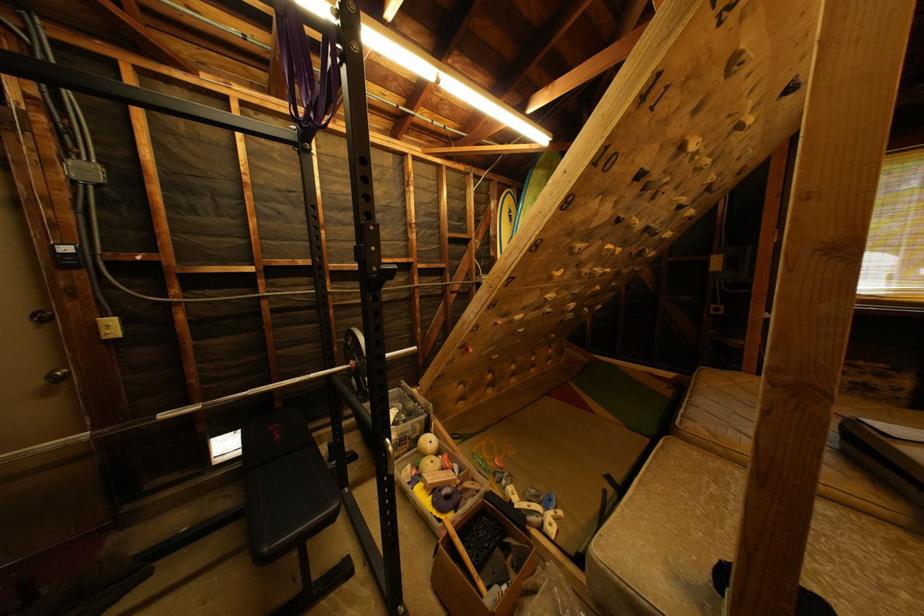
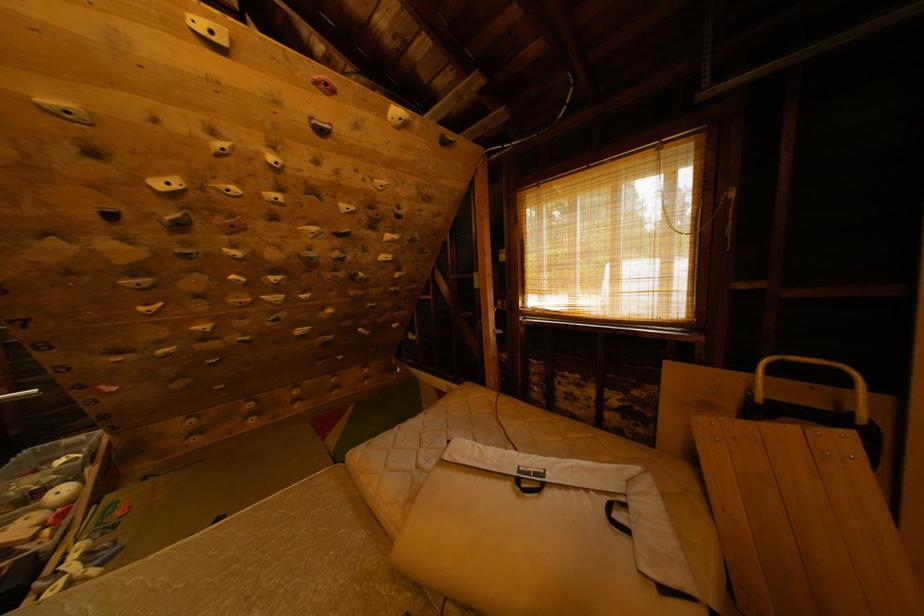
Question: What movement of the cameraman would produce the second image?

Choices:
 (A) Left
 (B) Right
 (C) Forward
 (D) Backward

Answer: (B)